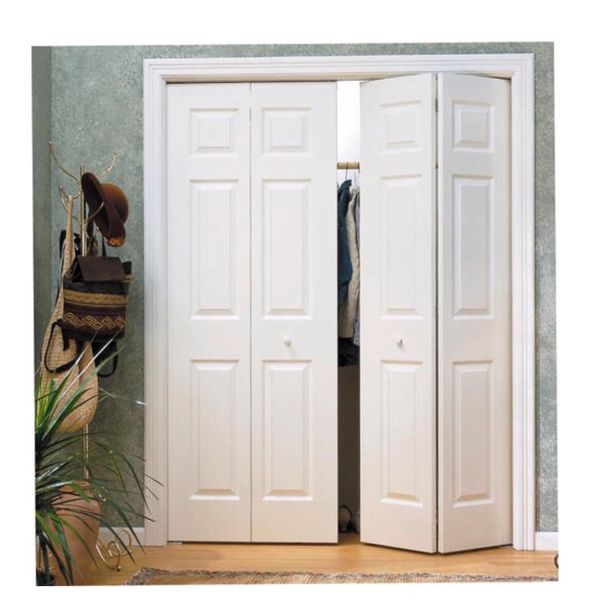
Identify the location of knob. (397, 345).